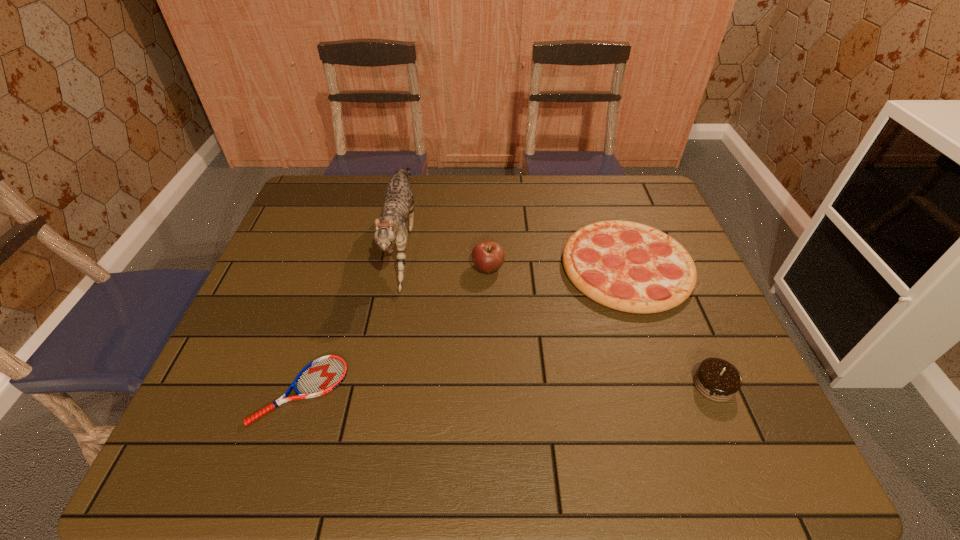
Identify the location of the tallest object. The width and height of the screenshot is (960, 540). (391, 227).

I want to click on cat, so click(x=391, y=227).

I want to click on the third object from left to right, so click(488, 256).

Identify the location of chocolate cake. (716, 379).

At what (x,y) coordinates should I click in order to perform the action: click on the fourth tallest object. Please return your answer as a coordinate pair (x, y). Looking at the image, I should click on (627, 266).

The image size is (960, 540). Identify the location of the shortest object. (321, 376).

Locate an element on the screen. Image resolution: width=960 pixels, height=540 pixels. tennis racket is located at coordinates (321, 376).

Where is `vacant space situated on the face of the cat`? vacant space situated on the face of the cat is located at coordinates (375, 377).

The height and width of the screenshot is (540, 960). What are the coordinates of `vacant position located 0.150m on the side of the third object from left to right with the unique marking` in the screenshot? It's located at (419, 268).

Find the location of `vacant area situated 0.320m on the side of the third object from left to right with the unique marking`. vacant area situated 0.320m on the side of the third object from left to right with the unique marking is located at coordinates (357, 268).